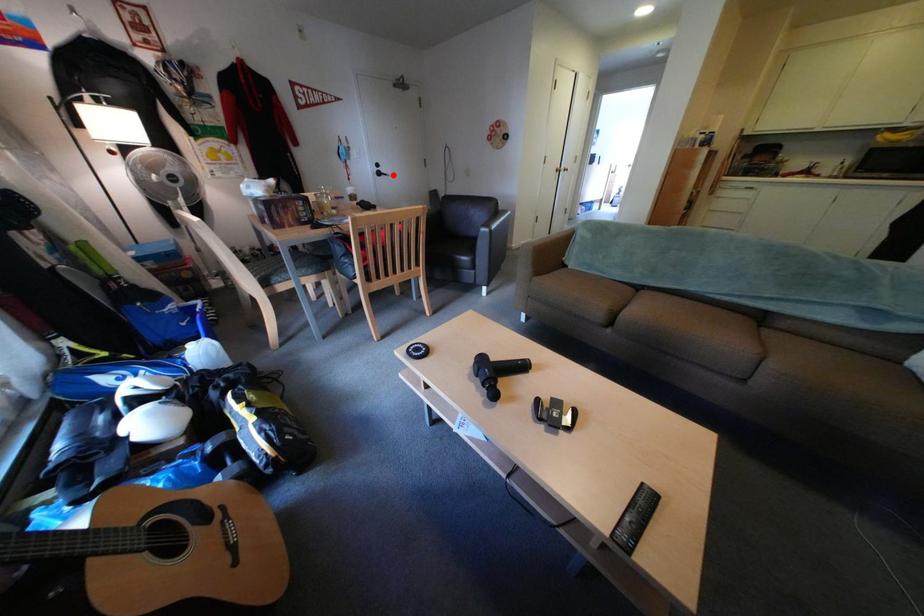
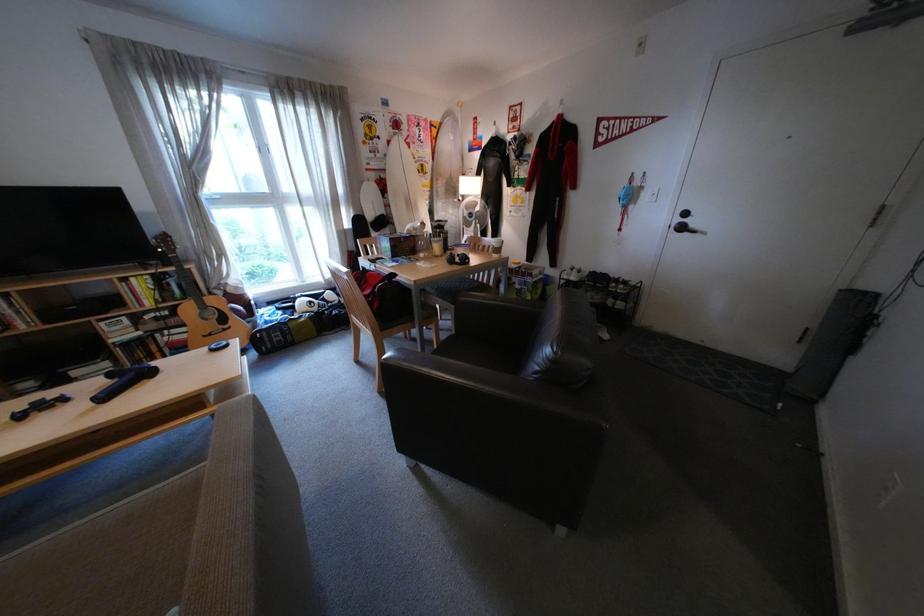
Question: I am providing you with two images of the same scene from different viewpoints. A red point is marked on the first image. Can you still see the location of the red point in image 2?

Choices:
 (A) Yes
 (B) No

Answer: (A)